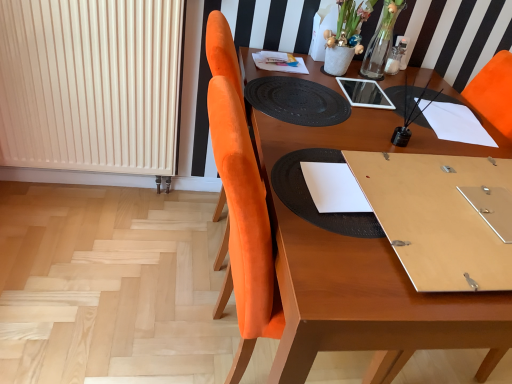
Question: From a real-world perspective, is white matte vase at upper center over black textured placemat at center?

Choices:
 (A) no
 (B) yes

Answer: (B)

Question: Considering the relative sizes of white matte vase at upper center and black textured placemat at center in the image provided, is white matte vase at upper center wider than black textured placemat at center?

Choices:
 (A) no
 (B) yes

Answer: (A)

Question: Could you tell me if white matte vase at upper center is facing black textured placemat at center?

Choices:
 (A) yes
 (B) no

Answer: (A)

Question: Can we say white matte vase at upper center lies outside black textured placemat at center?

Choices:
 (A) no
 (B) yes

Answer: (B)

Question: Can you confirm if white matte vase at upper center is thinner than black textured placemat at center?

Choices:
 (A) no
 (B) yes

Answer: (B)

Question: From a real-world perspective, is white matte vase at upper center below black textured placemat at center?

Choices:
 (A) yes
 (B) no

Answer: (B)

Question: Is white paper at center shorter than wooden table at center?

Choices:
 (A) yes
 (B) no

Answer: (A)

Question: Is white paper at center at the right side of wooden table at center?

Choices:
 (A) yes
 (B) no

Answer: (B)

Question: From a real-world perspective, does white paper at center stand above wooden table at center?

Choices:
 (A) yes
 (B) no

Answer: (A)

Question: Considering the relative sizes of white paper at center and wooden table at center in the image provided, is white paper at center bigger than wooden table at center?

Choices:
 (A) no
 (B) yes

Answer: (A)

Question: From a real-world perspective, is white paper at center below wooden table at center?

Choices:
 (A) yes
 (B) no

Answer: (B)

Question: Is white paper at center wider than wooden table at center?

Choices:
 (A) yes
 (B) no

Answer: (B)

Question: Does white paper at center have a lesser height compared to white ribbed radiator at left?

Choices:
 (A) no
 (B) yes

Answer: (B)